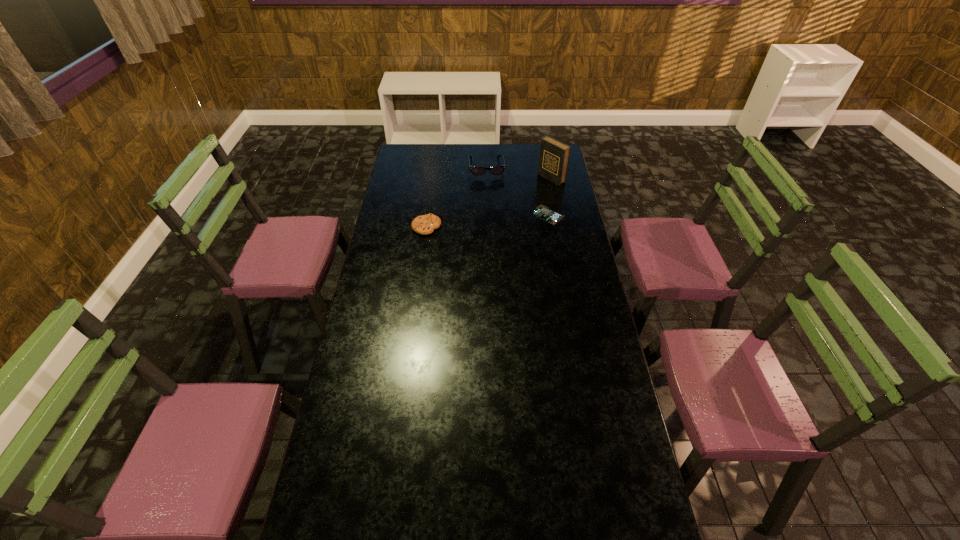
This screenshot has height=540, width=960. In order to click on vacant space on the desktop that is between the leftmost object and the identity card and is positioned on the front cover of the tallest object in this screenshot , I will do `click(477, 222)`.

The image size is (960, 540). In order to click on free space on the desktop that is between the leftmost object and the identity card and is positioned on the lenses of the second object from left to right in this screenshot , I will do `click(493, 220)`.